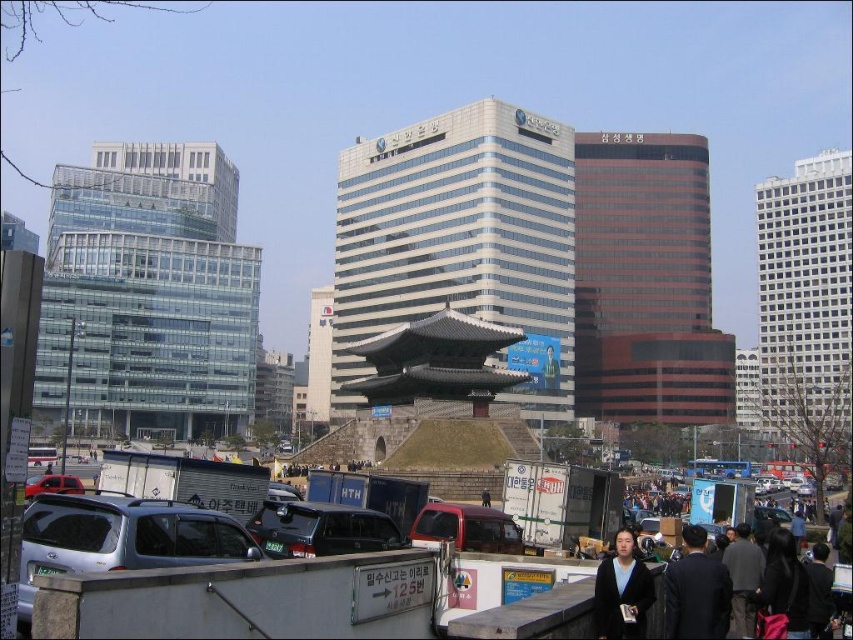
You are a tourist standing in the bustling urban scene and want to take a photo of the transparent glass building at left and the white glass tower at center. Which one should you point your camera upwards to capture?

You should point your camera upwards to capture the transparent glass building at left because it is located above the white glass tower at center.

You are standing at the point marked by point (120,538). Which direction should you turn to face the silver metallic suv at lower left?

The silver metallic suv at lower left is located at point (120,538), so you are already facing it. No turn is needed.

You are a photographer setting up a tripod in the foreground of this urban scene. You need to position your equipment so that both the black matte jacket at lower right and the matte red car at lower left are visible in the frame. Considering their sizes, which object should be placed closer to the camera to maintain balance in the composition?

The black matte jacket at lower right is smaller in size compared to the matte red car at lower left. To balance the composition, the smaller black matte jacket at lower right should be placed closer to the camera while the larger matte red car at lower left can be positioned farther back.